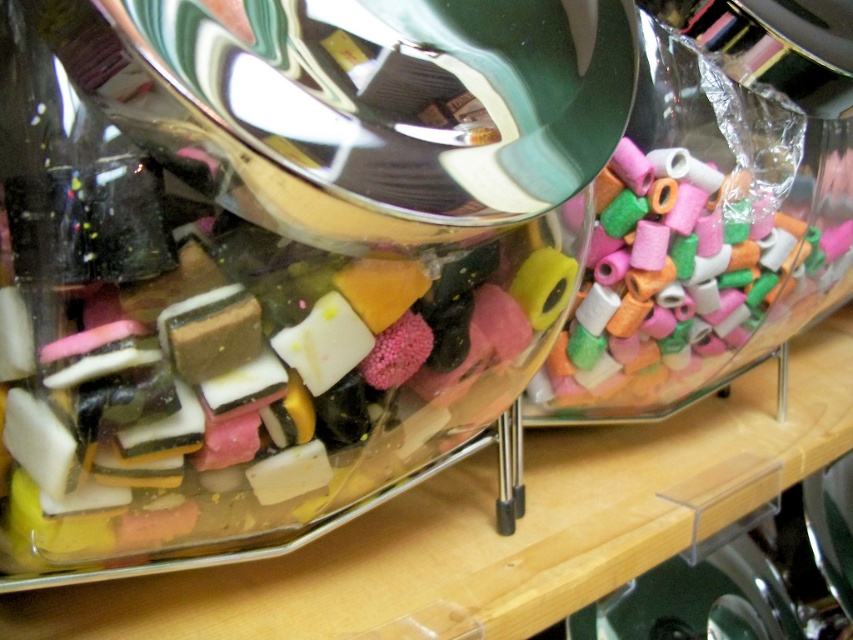
Between translucent glass candy at center and translucent plastic beads at right, which one has less height?

Standing shorter between the two is translucent glass candy at center.

Which is behind, point (218, 499) or point (659, 173)?

The point (659, 173) is more distant.

The width and height of the screenshot is (853, 640). Identify the location of translucent glass candy at center. (227, 326).